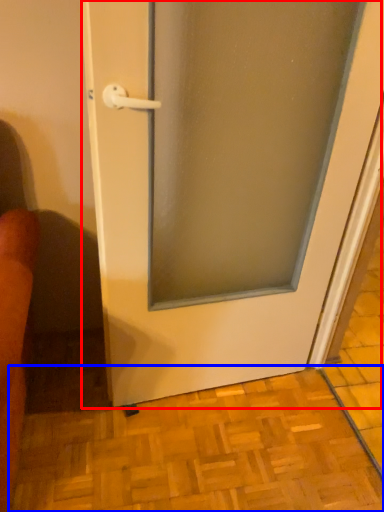
Question: Among these objects, which one is farthest to the camera, door (highlighted by a red box) or tile (highlighted by a blue box)?

Choices:
 (A) door
 (B) tile

Answer: (B)